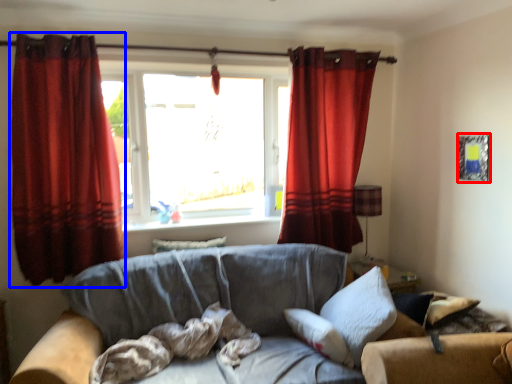
Question: Which object is closer to the camera taking this photo, picture frame (highlighted by a red box) or curtain (highlighted by a blue box)?

Choices:
 (A) picture frame
 (B) curtain

Answer: (B)